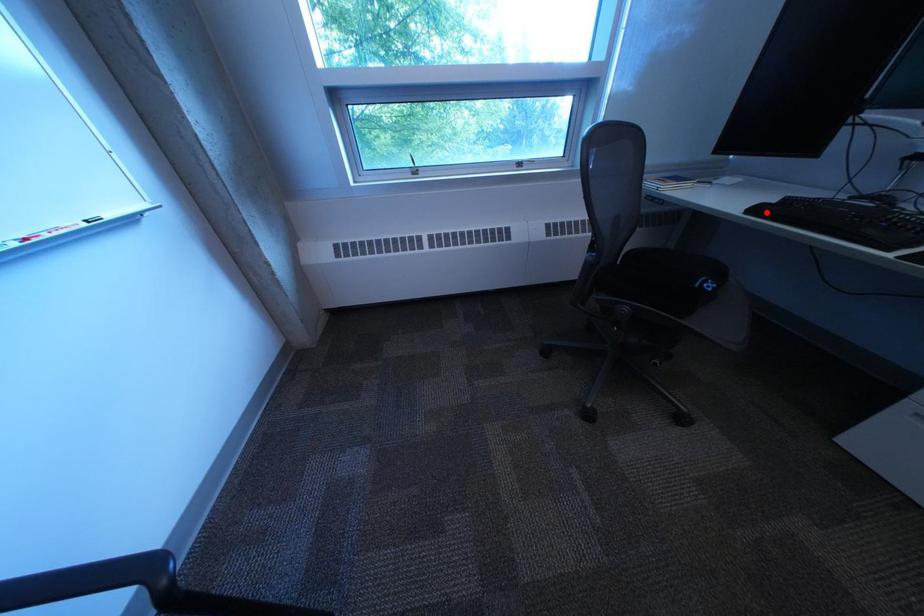
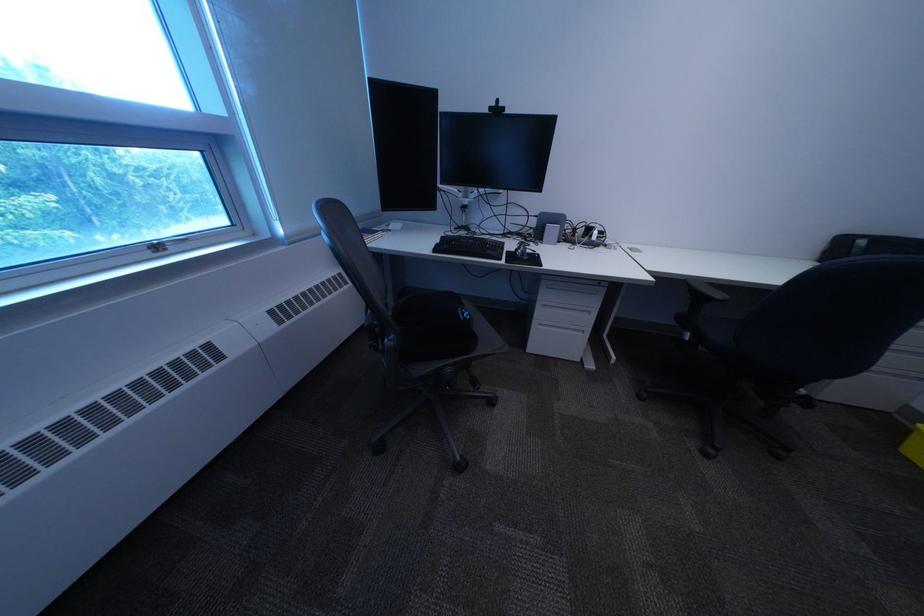
The point at the highlighted location is marked in the first image. Where is the corresponding point in the second image?

(451, 252)